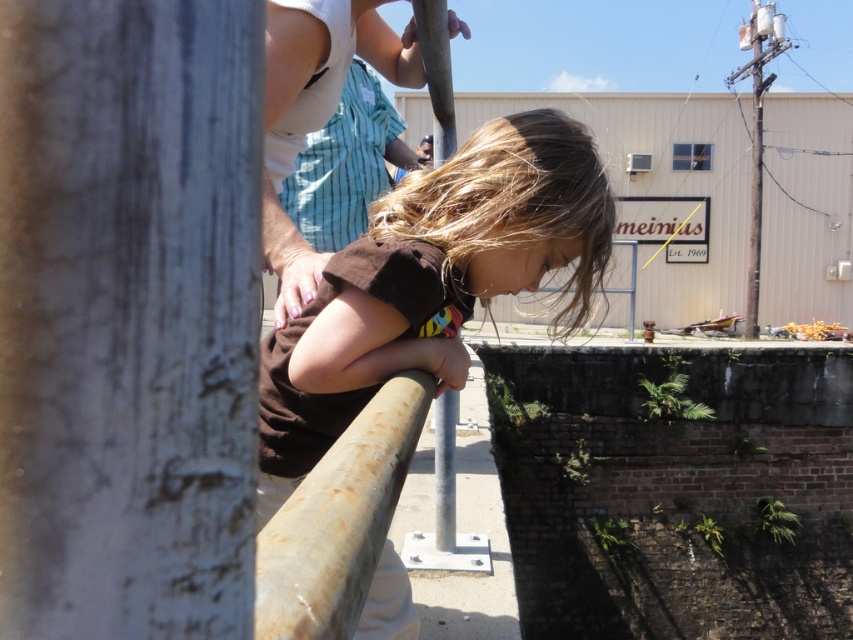
Is brown matte shirt at center taller than brown matte hair at center?

Yes, brown matte shirt at center is taller than brown matte hair at center.

Who is shorter, brown matte shirt at center or brown matte hair at center?

brown matte hair at center is shorter.

The image size is (853, 640). I want to click on brown matte shirt at center, so click(x=432, y=282).